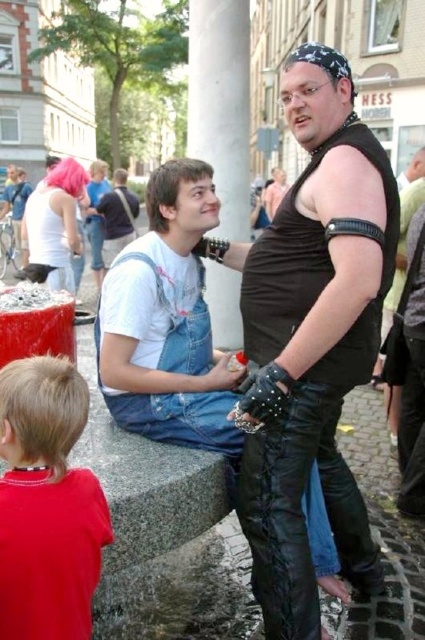
Question: Which object is the farthest from the black leather pants at center?

Choices:
 (A) red cotton shirt at lower left
 (B) denim overalls at center

Answer: (A)

Question: Which point appears closest to the camera in this image?

Choices:
 (A) (110, 387)
 (B) (34, 428)

Answer: (B)

Question: Does black leather pants at center have a smaller size compared to red cotton shirt at lower left?

Choices:
 (A) no
 (B) yes

Answer: (A)

Question: Which point appears farthest from the camera in this image?

Choices:
 (A) (215, 429)
 (B) (82, 605)

Answer: (A)

Question: Observing the image, what is the correct spatial positioning of black leather pants at center in reference to red cotton shirt at lower left?

Choices:
 (A) left
 (B) right

Answer: (B)

Question: Does black leather pants at center have a smaller size compared to red cotton shirt at lower left?

Choices:
 (A) no
 (B) yes

Answer: (A)